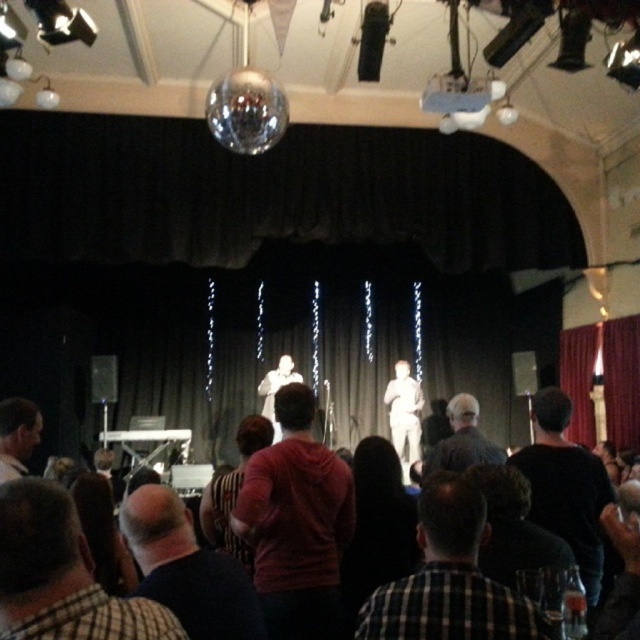
Question: Is checkered fabric shirt at center thinner than matte white shirt at center?

Choices:
 (A) yes
 (B) no

Answer: (A)

Question: Which object appears closest to the camera in this image?

Choices:
 (A) red hoodie at center
 (B) smooth black shirt at lower left
 (C) checkered fabric shirt at center
 (D) gray hair at center

Answer: (C)

Question: Based on their relative distances, which object is nearer to the smooth black shirt at lower left?

Choices:
 (A) black matte shirt at center
 (B) checkered fabric shirt at center

Answer: (B)

Question: Is black matte shirt at center smaller than gray hair at center?

Choices:
 (A) no
 (B) yes

Answer: (A)

Question: Which point appears farthest from the camera in this image?

Choices:
 (A) (284, 384)
 (B) (38, 419)

Answer: (A)

Question: Where is dark brown hair at lower left located in relation to smooth black shirt at lower left in the image?

Choices:
 (A) left
 (B) right

Answer: (B)